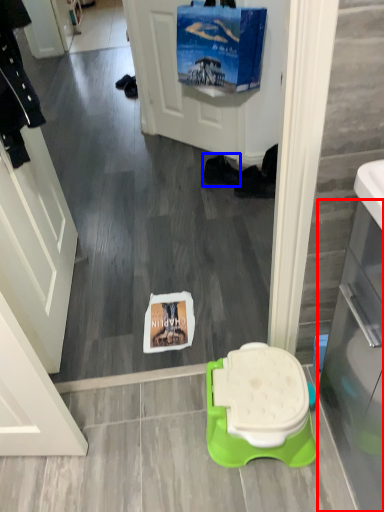
Question: Which object appears closest to the camera in this image, glass door (highlighted by a red box) or footwear (highlighted by a blue box)?

Choices:
 (A) glass door
 (B) footwear

Answer: (A)